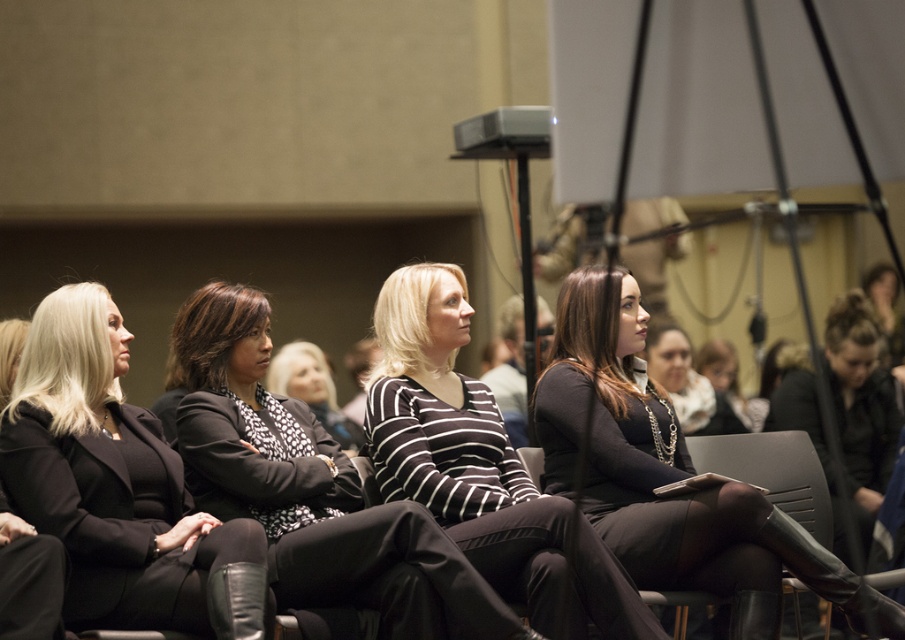
Looking at this image, does matte black dress at center have a smaller size compared to striped fabric sweater at center?

Result: No.

How far apart are matte black dress at center and striped fabric sweater at center?

They are 2.10 meters apart.

Between point (559, 396) and point (344, 449), which one is positioned in front?

Point (559, 396) is more forward.

Locate an element on the screen. The height and width of the screenshot is (640, 905). matte black dress at center is located at coordinates (665, 474).

Which is above, black textured blazer at center or black striped sweater at center?

Positioned higher is black striped sweater at center.

Between black textured blazer at center and black striped sweater at center, which one has more height?

With more height is black striped sweater at center.

What are the coordinates of `black textured blazer at center` in the screenshot? It's located at (311, 488).

Locate an element on the screen. The height and width of the screenshot is (640, 905). black textured blazer at center is located at coordinates (311, 488).

Based on the photo, between matte black dress at center and black striped sweater at center, which one is positioned lower?

black striped sweater at center is lower down.

Does matte black dress at center appear on the left side of black striped sweater at center?

No, matte black dress at center is not to the left of black striped sweater at center.

Locate an element on the screen. The width and height of the screenshot is (905, 640). matte black dress at center is located at coordinates (665, 474).